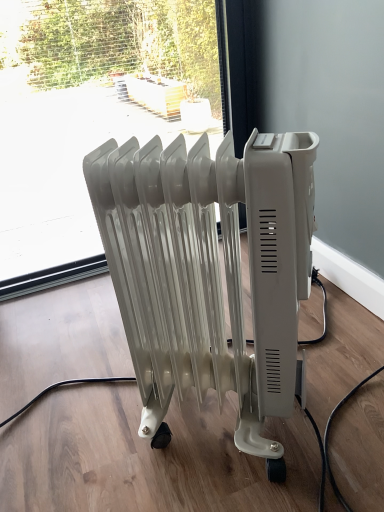
Question: Considering the positions of transparent glass window at center and white plastic radiator at center in the image, is transparent glass window at center taller or shorter than white plastic radiator at center?

Choices:
 (A) tall
 (B) short

Answer: (A)

Question: From a real-world perspective, is transparent glass window at center above or below white plastic radiator at center?

Choices:
 (A) above
 (B) below

Answer: (A)

Question: Is transparent glass window at center situated inside white plastic radiator at center or outside?

Choices:
 (A) inside
 (B) outside

Answer: (B)

Question: Is white plastic radiator at center bigger or smaller than transparent glass window at center?

Choices:
 (A) small
 (B) big

Answer: (A)

Question: In the image, is white plastic radiator at center positioned in front of or behind transparent glass window at center?

Choices:
 (A) behind
 (B) front

Answer: (B)

Question: Is point (276, 302) closer or farther from the camera than point (24, 271)?

Choices:
 (A) farther
 (B) closer

Answer: (B)

Question: Is white plastic radiator at center inside or outside of transparent glass window at center?

Choices:
 (A) inside
 (B) outside

Answer: (B)